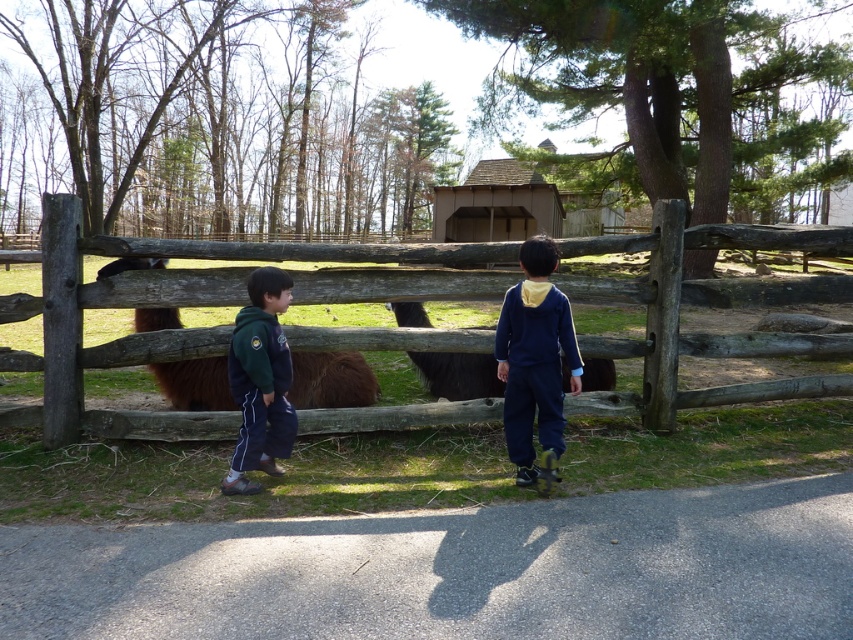
Who is lower down, brown wooden fence at center or navy blue sweatshirt at center?

navy blue sweatshirt at center is lower down.

Does brown wooden fence at center have a greater width compared to navy blue sweatshirt at center?

Indeed, brown wooden fence at center has a greater width compared to navy blue sweatshirt at center.

Does point (793, 289) lie behind point (554, 369)?

Yes, point (793, 289) is farther from viewer.

Find the location of a particular element. brown wooden fence at center is located at coordinates (105, 342).

Is brown fuzzy alpaca at center positioned at the back of dark brown woolly alpaca at center?

No, it is in front of dark brown woolly alpaca at center.

Can you confirm if brown fuzzy alpaca at center is positioned below dark brown woolly alpaca at center?

Indeed, brown fuzzy alpaca at center is positioned under dark brown woolly alpaca at center.

Locate an element on the screen. The width and height of the screenshot is (853, 640). brown fuzzy alpaca at center is located at coordinates (331, 380).

In the scene shown: Does green fleece jacket at center appear on the left side of dark brown woolly alpaca at center?

Indeed, green fleece jacket at center is positioned on the left side of dark brown woolly alpaca at center.

In the scene shown: Who is more forward, (276, 452) or (583, 368)?

Positioned in front is point (276, 452).

Consider the image. Measure the distance between green fleece jacket at center and camera.

The distance of green fleece jacket at center from camera is 4.29 meters.

This screenshot has height=640, width=853. I want to click on green fleece jacket at center, so click(260, 381).